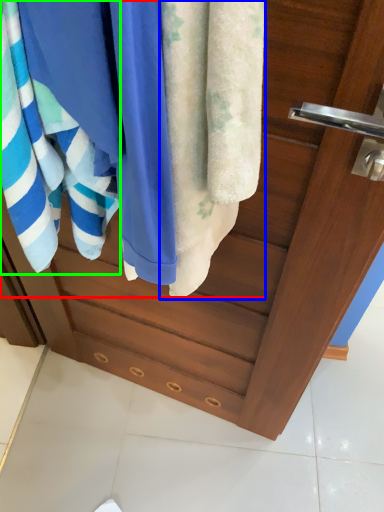
Question: Which object is positioned closest to beach towel (highlighted by a red box)? Select from towel (highlighted by a blue box) and towel (highlighted by a green box).

Choices:
 (A) towel
 (B) towel

Answer: (A)